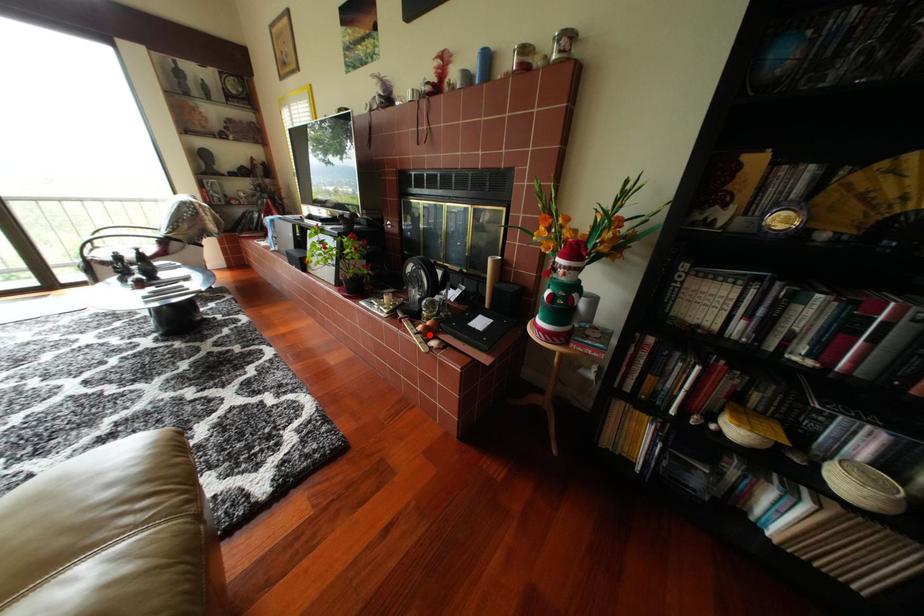
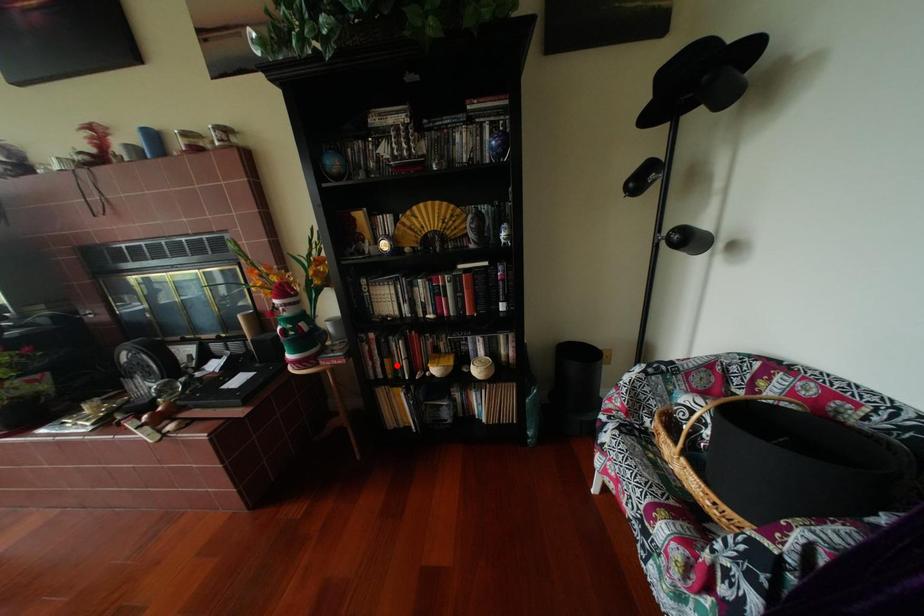
I am providing you with two images of the same scene from different viewpoints. A red point is marked on the first image and another point is marked on the second image. Is the red point in image1 aligned with the point shown in image2?

No